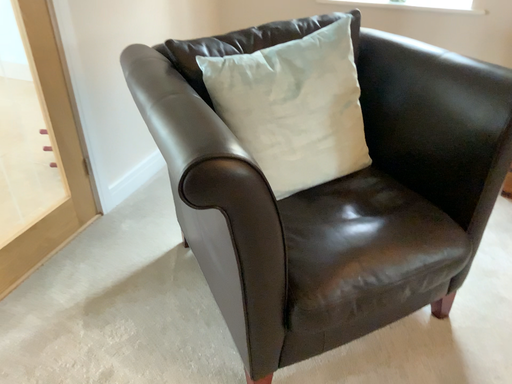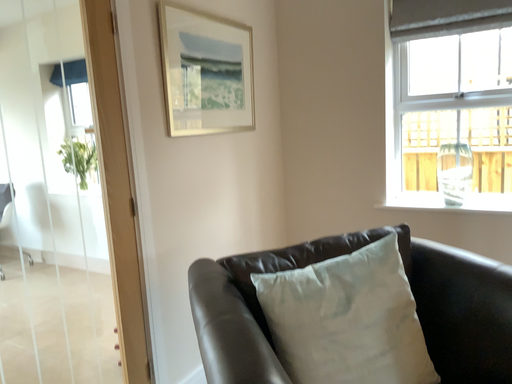
Question: How did the camera likely rotate when shooting the video?

Choices:
 (A) rotated downward
 (B) rotated upward

Answer: (B)